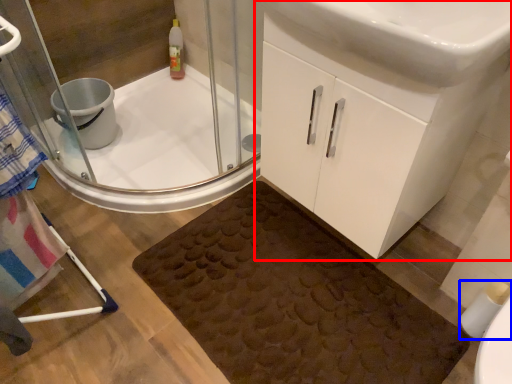
Question: Which point is closer to the camera, bathroom cabinet (highlighted by a red box) or toilet paper (highlighted by a blue box)?

Choices:
 (A) bathroom cabinet
 (B) toilet paper

Answer: (A)